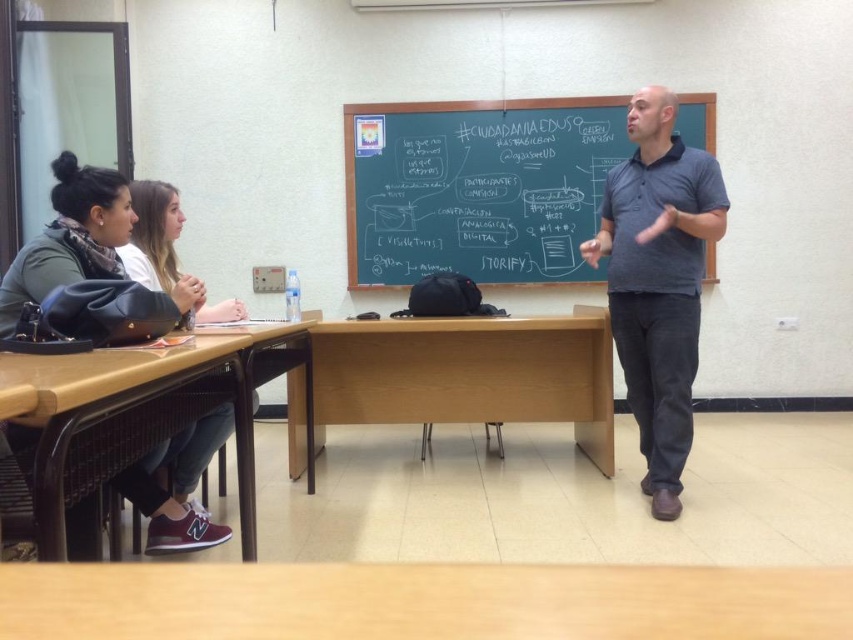
Question: Does wooden table at lower center lie in front of green chalkboard at center?

Choices:
 (A) no
 (B) yes

Answer: (B)

Question: Can you confirm if light brown wood table at center is positioned to the left of dark blue polo shirt at center?

Choices:
 (A) yes
 (B) no

Answer: (A)

Question: Among these objects, which one is nearest to the camera?

Choices:
 (A) light brown wood table at center
 (B) wooden table at lower center
 (C) green chalkboard at center
 (D) dark blue polo shirt at center

Answer: (B)

Question: Which point is farther to the camera?

Choices:
 (A) brown wooden table at lower left
 (B) dark blue polo shirt at center
 (C) suede leather jacket at left

Answer: (B)

Question: Which object is the farthest from the brown wooden table at lower left?

Choices:
 (A) wooden table at lower center
 (B) suede leather jacket at left

Answer: (A)

Question: Is wooden table at lower center above light brown wood table at center?

Choices:
 (A) yes
 (B) no

Answer: (A)